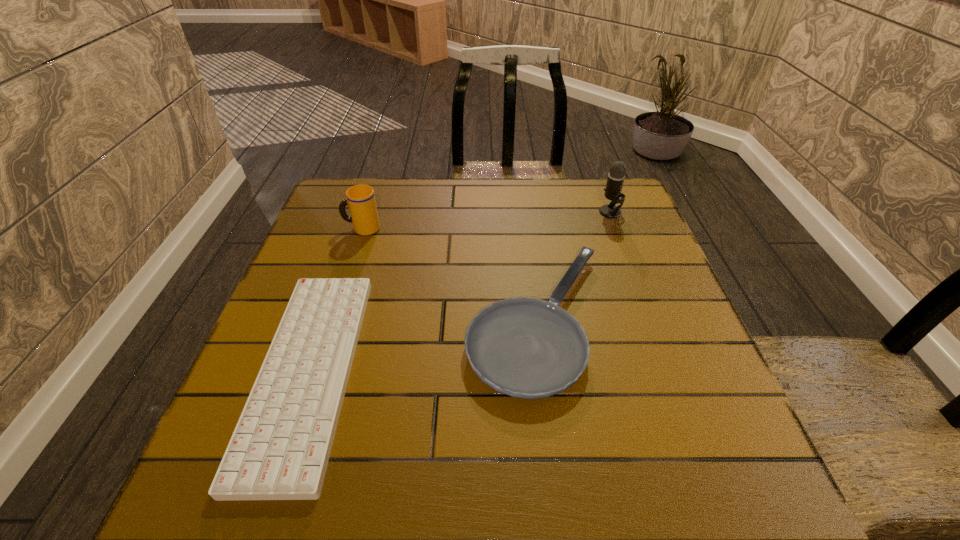
This screenshot has height=540, width=960. Find the location of `the rightmost object`. the rightmost object is located at coordinates pos(616,176).

Image resolution: width=960 pixels, height=540 pixels. In order to click on the farthest object in this screenshot , I will do `click(616, 176)`.

The height and width of the screenshot is (540, 960). Find the location of `cup`. cup is located at coordinates point(361,200).

Find the location of `the third shortest object`. the third shortest object is located at coordinates (361, 200).

At what (x,y) coordinates should I click in order to perform the action: click on frying pan. Please return your answer as a coordinate pair (x, y). The image size is (960, 540). Looking at the image, I should click on (529, 348).

This screenshot has height=540, width=960. I want to click on the third object from left to right, so click(x=529, y=348).

The height and width of the screenshot is (540, 960). In order to click on the shortest object in this screenshot , I will do `click(280, 448)`.

You are a GUI agent. You are given a task and a screenshot of the screen. Output one action in this format:
    pyautogui.click(x=<x>, y=<y>)
    Task: Click on the free region located on the front of the microphone
    The width and height of the screenshot is (960, 540).
    Given the screenshot: What is the action you would take?
    pyautogui.click(x=640, y=292)

This screenshot has width=960, height=540. What are the coordinates of `vacant space located on the left of the third object from left to right` in the screenshot? It's located at (314, 320).

Image resolution: width=960 pixels, height=540 pixels. I want to click on blank area located 0.050m on the back of the shortest object, so click(x=343, y=271).